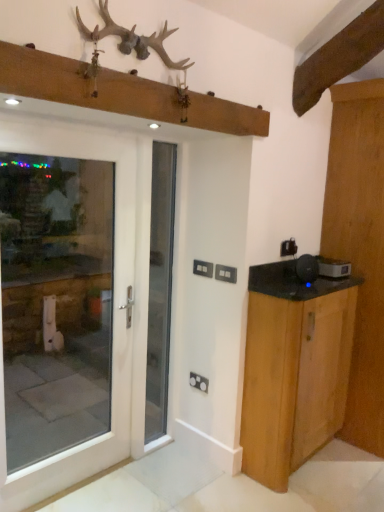
Question: Is black plastic speaker at right, which is the first appliance from back to front, placed right next to wooden cabinet at right, acting as the 1th door starting from the back?

Choices:
 (A) yes
 (B) no

Answer: (B)

Question: Considering the relative sizes of black plastic speaker at right, which is the first appliance from right to left, and wooden cabinet at right, the 2th door positioned from the left, in the image provided, is black plastic speaker at right, which is the first appliance from right to left, bigger than wooden cabinet at right, the 2th door positioned from the left,?

Choices:
 (A) yes
 (B) no

Answer: (B)

Question: Does black plastic speaker at right, the 2th appliance viewed from the front, come behind wooden cabinet at right, the 1th door positioned from the right?

Choices:
 (A) yes
 (B) no

Answer: (A)

Question: Are black plastic speaker at right, the 2th appliance viewed from the front, and wooden cabinet at right, the 1th door positioned from the right, located far from each other?

Choices:
 (A) no
 (B) yes

Answer: (A)

Question: Does black plastic speaker at right, arranged as the second appliance when viewed from the left, have a lesser width compared to wooden cabinet at right, the 2th door positioned from the left?

Choices:
 (A) yes
 (B) no

Answer: (A)

Question: Is black plastic speaker at right, the 2th appliance viewed from the front, to the right of wooden cabinet at right, the 1th door positioned from the right, from the viewer's perspective?

Choices:
 (A) no
 (B) yes

Answer: (A)

Question: Can you confirm if black plastic speaker at right, the 2th appliance in the right-to-left sequence, is taller than black plastic speaker at right, arranged as the second appliance when viewed from the left?

Choices:
 (A) yes
 (B) no

Answer: (A)

Question: Is the surface of black plastic speaker at right, the 2th appliance in the right-to-left sequence, in direct contact with black plastic speaker at right, the 2th appliance viewed from the front?

Choices:
 (A) yes
 (B) no

Answer: (A)

Question: Does black plastic speaker at right, the 2th appliance in the right-to-left sequence, appear on the right side of black plastic speaker at right, which is the first appliance from right to left?

Choices:
 (A) yes
 (B) no

Answer: (B)

Question: Is black plastic speaker at right, the 1th appliance positioned from the front, positioned with its back to black plastic speaker at right, which is the first appliance from back to front?

Choices:
 (A) yes
 (B) no

Answer: (B)

Question: Is black plastic speaker at right, the 1th appliance positioned from the front, closer to the viewer compared to black plastic speaker at right, which is the first appliance from back to front?

Choices:
 (A) no
 (B) yes

Answer: (B)

Question: Can we say black plastic speaker at right, the second appliance when ordered from back to front, lies outside black plastic speaker at right, which is the first appliance from right to left?

Choices:
 (A) no
 (B) yes

Answer: (B)

Question: Does black plastic speaker at right, which is the 1th appliance in left-to-right order, lie behind antlered wooden rack at upper center?

Choices:
 (A) yes
 (B) no

Answer: (A)